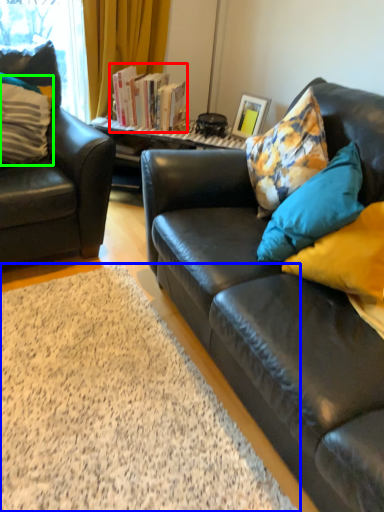
Question: Which object is the closest to the book (highlighted by a red box)? Choose among these: plain (highlighted by a blue box) or pillow (highlighted by a green box).

Choices:
 (A) plain
 (B) pillow

Answer: (B)